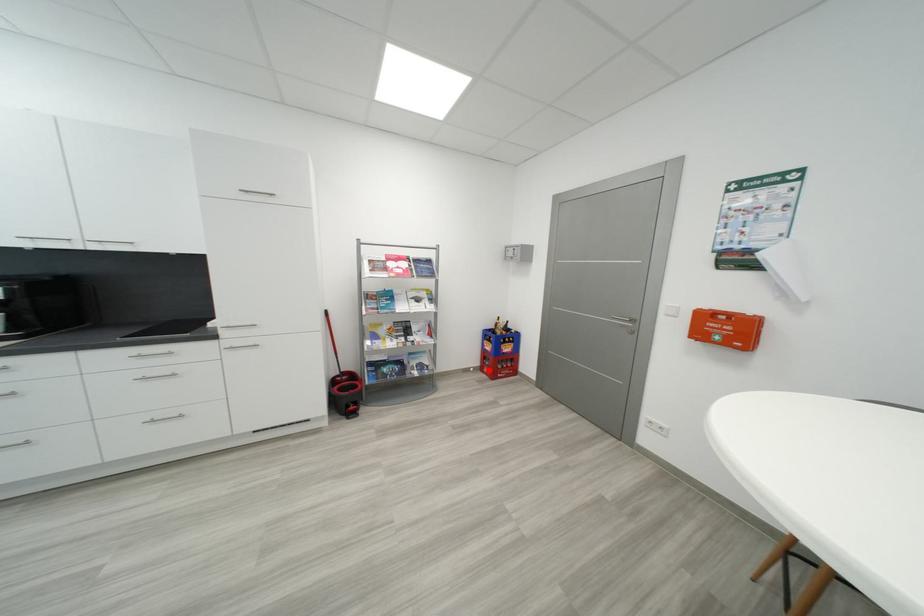
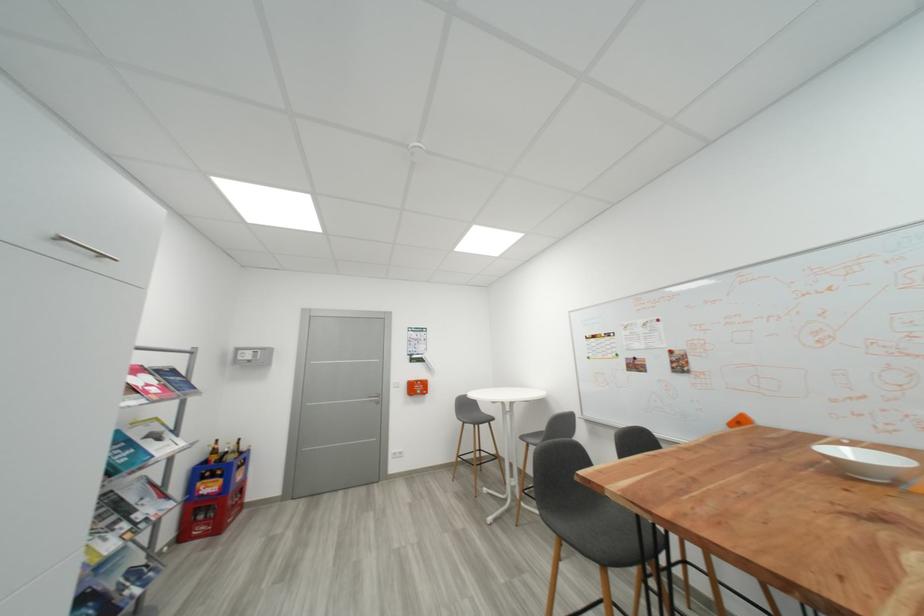
Question: I am providing you with two images of the same scene from different viewpoints. A red point is marked on the first image. At the location where the point appears in image 1, is it still visible in image 2?

Choices:
 (A) Yes
 (B) No

Answer: (A)